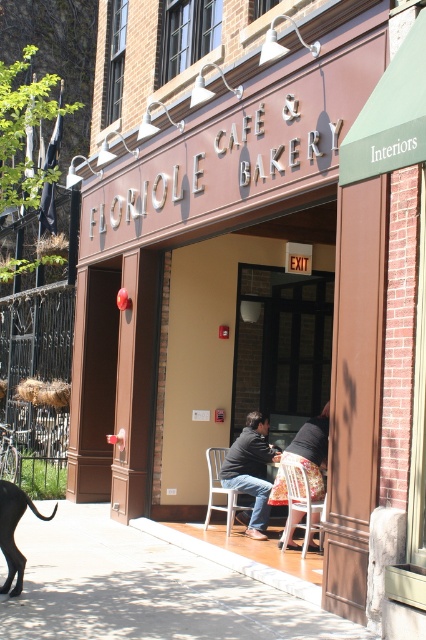
Question: Which object appears closest to the camera in this image?

Choices:
 (A) wooden at center
 (B) metallic silver chair at lower center

Answer: (A)

Question: Is smooth concrete pavement at center behind metallic silver chair at lower center?

Choices:
 (A) no
 (B) yes

Answer: (A)

Question: Which point is closer to the camera?

Choices:
 (A) (213, 449)
 (B) (247, 525)
 (C) (296, 477)

Answer: (C)

Question: Does wooden at center have a smaller size compared to metallic silver chair at lower center?

Choices:
 (A) no
 (B) yes

Answer: (B)

Question: Among these objects, which one is nearest to the camera?

Choices:
 (A) metallic silver chair at lower center
 (B) dark gray sweater at center
 (C) smooth concrete pavement at center

Answer: (C)

Question: Is smooth concrete pavement at center thinner than dark gray sweater at center?

Choices:
 (A) yes
 (B) no

Answer: (B)